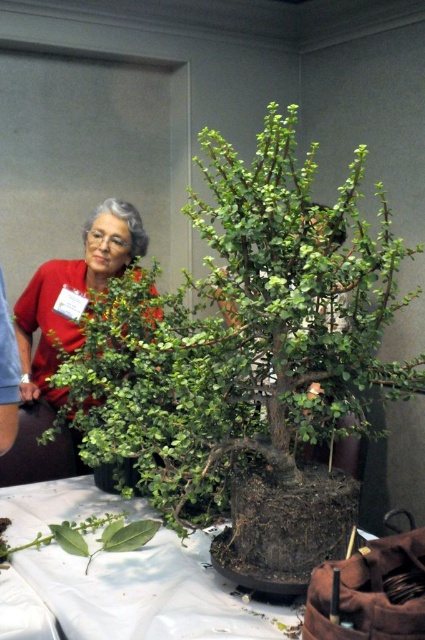
You are a photographer trying to capture a closeup of the green matte bonsai tree at center without the matte red blouse at center appearing in the shot. Given that the bonsai is 22.46 inches away from the blouse, what is the minimum distance you need to move backward from the bonsai to ensure the blouse is out of frame?

The minimum distance to move backward would need to be calculated based on the camera lens angle and sensor size, but since the bonsai is 22.46 inches away from the blouse, moving back at least 22.46 inches from the bonsai should place you far enough to exclude the blouse from the frame.

You are a visitor at an exhibition and see the green matte bonsai tree at center and the white fabric table at center. Which object takes up more space in the image?

The green matte bonsai tree at center is bigger than the white fabric table at center, so it takes up more space in the image.